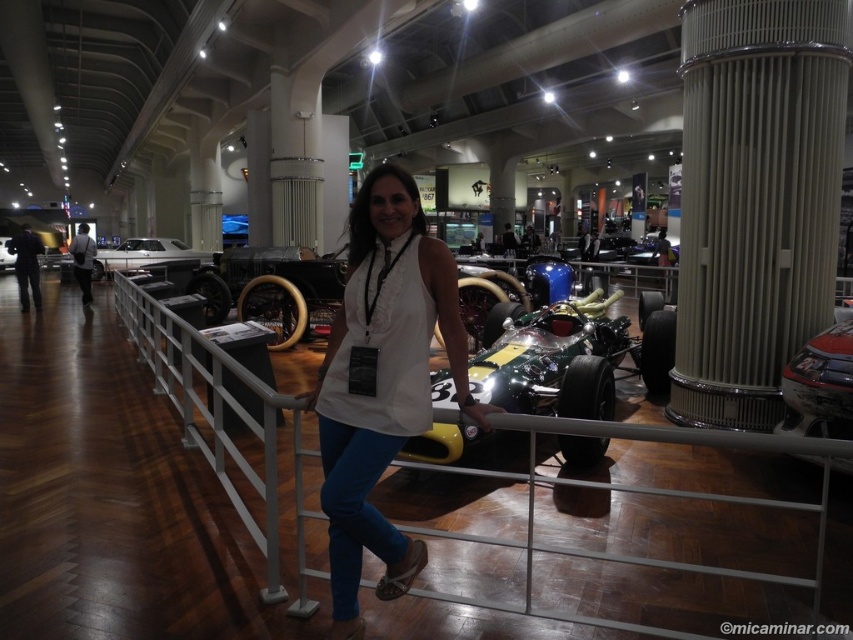
You are a visitor standing at the entrance of the museum. You see the shiny silver car at center and the matte beige column at center right. Which object is positioned to the right of the other?

The matte beige column at center right is positioned to the right of the shiny silver car at center.

You are an event organizer planning to place a new sculpture between the matte beige column at center right and the shiny metallic race car at center. Based on their widths, which object should the sculpture be closer to to ensure it doesn

The sculpture should be placed closer to the shiny metallic race car at center since the matte beige column at center right has a lesser width, meaning the race car is wider and can accommodate a larger sculpture next to it.

You are a photographer planning to take a photo of both the shiny metallic race car at center and the shiny silver car at center. Since you want to emphasize the size difference between them, which car should you position closer to the camera to achieve this effect?

To emphasize the size difference between the shiny metallic race car at center and the shiny silver car at center, you should position the smaller shiny metallic race car at center closer to the camera. This will make it appear larger in the photo, contrasting with the larger shiny silver car at center placed farther back, thereby highlighting their size contrast.